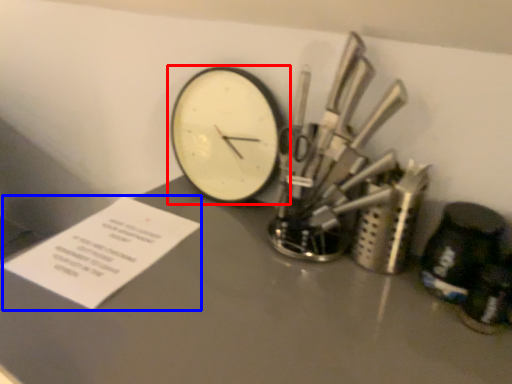
Question: Which object is closer to the camera taking this photo, wall clock (highlighted by a red box) or paper (highlighted by a blue box)?

Choices:
 (A) wall clock
 (B) paper

Answer: (B)